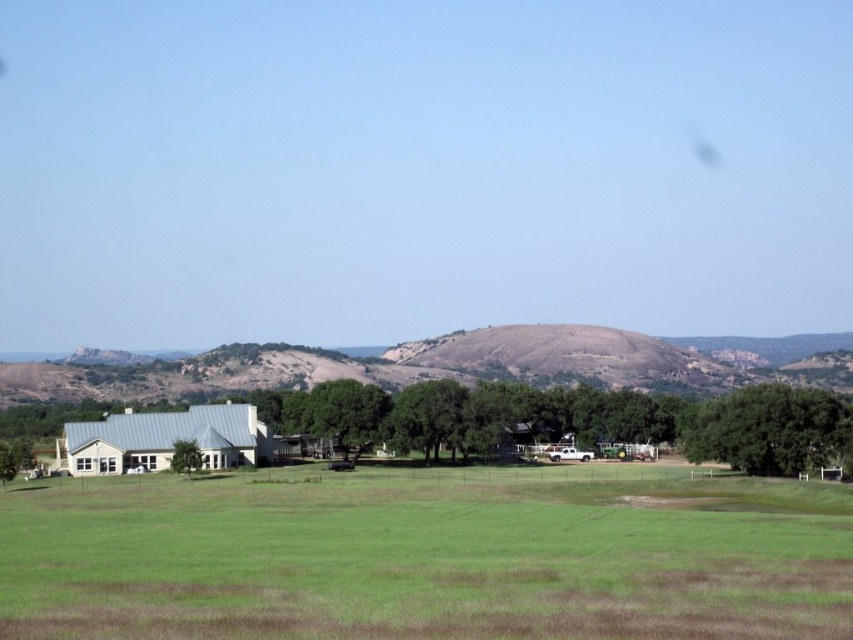
Question: Is green leafy tree at center-right thinner than green leafy tree at lower left?

Choices:
 (A) yes
 (B) no

Answer: (B)

Question: Which of the following is the farthest from the observer?

Choices:
 (A) green leafy tree at center-right
 (B) brown rocky mountain at center
 (C) green leafy tree at lower left

Answer: (B)

Question: Is brown rocky mountain at center wider than green leafy tree at lower left?

Choices:
 (A) no
 (B) yes

Answer: (B)

Question: Which point is farther to the camera?

Choices:
 (A) (192, 468)
 (B) (132, 516)

Answer: (A)

Question: Is brown rocky mountain at center to the right of green leafy tree at lower left from the viewer's perspective?

Choices:
 (A) yes
 (B) no

Answer: (A)

Question: Which is nearer to the green leafy tree at lower left?

Choices:
 (A) brown rocky mountain at center
 (B) green leafy tree at center-right
 (C) green grassy field at lower center

Answer: (C)